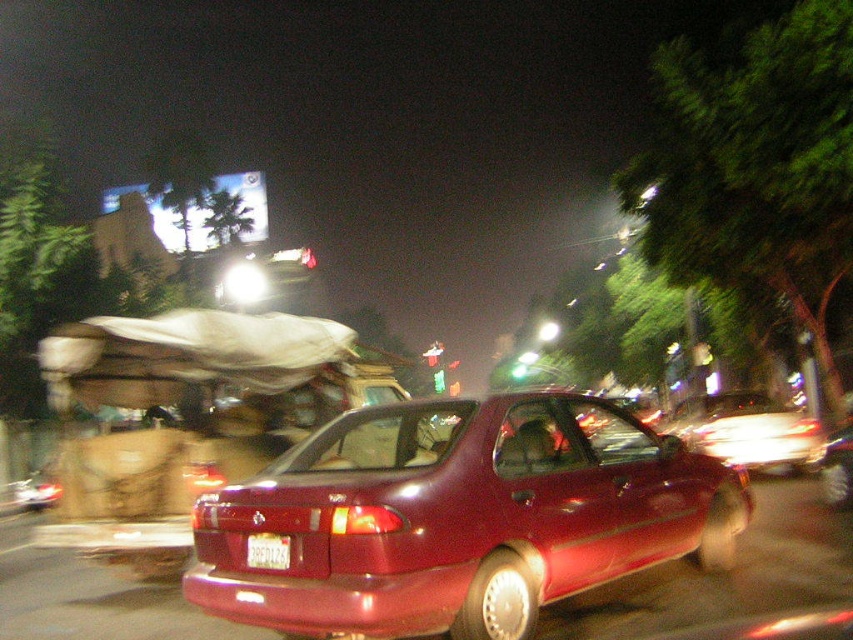
You are a traffic officer checking vehicle dimensions. You observe a matte red car at center and a white plastic license plate at rear. Which object has a greater width?

The matte red car at center has a greater width than the white plastic license plate at rear.

You are a parking assistant robot with a camera that can only focus on objects within 3 feet. You need to capture a clear image of the white plastic license plate at rear while avoiding the matte red car at center. Is this possible?

The distance between the matte red car at center and the white plastic license plate at rear is 3.41 feet. Since your camera can only focus on objects within 3 feet, capturing a clear image of the license plate while avoiding the car is not possible as the distance exceeds the camera range.